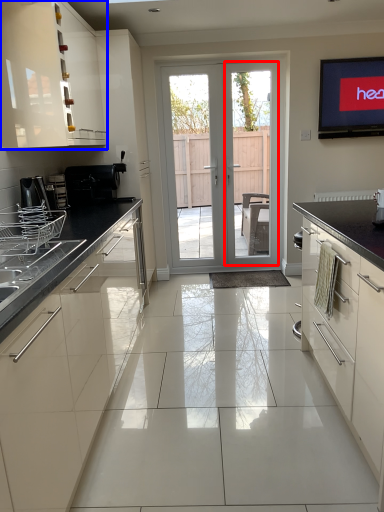
Question: Which object appears closest to the camera in this image, screen door (highlighted by a red box) or cabinetry (highlighted by a blue box)?

Choices:
 (A) screen door
 (B) cabinetry

Answer: (B)